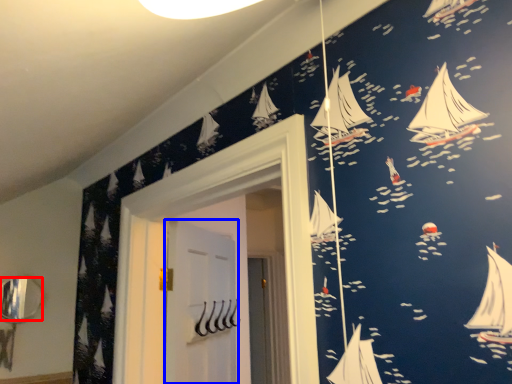
Question: Which of the following is the farthest to the observer, mirror (highlighted by a red box) or door (highlighted by a blue box)?

Choices:
 (A) mirror
 (B) door

Answer: (A)